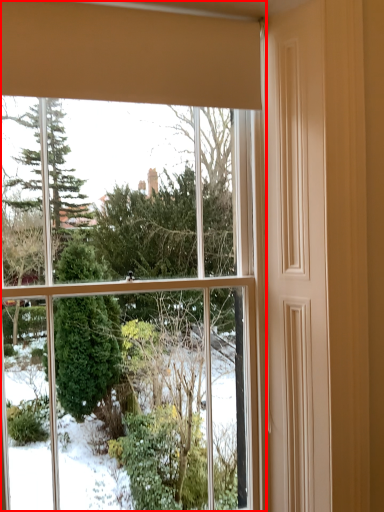
Question: From the image's perspective, where is window (annotated by the red box) located in relation to curtain in the image?

Choices:
 (A) above
 (B) below

Answer: (B)